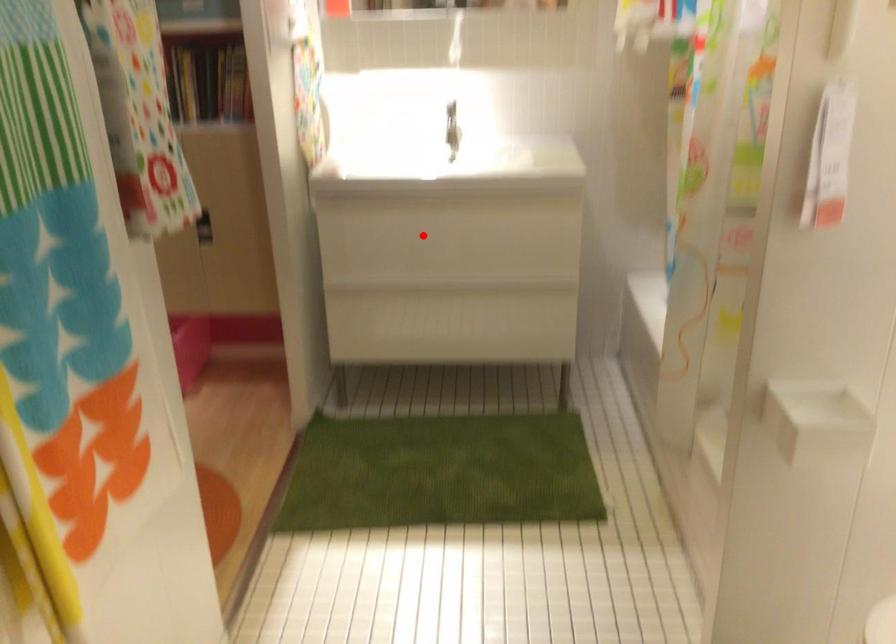
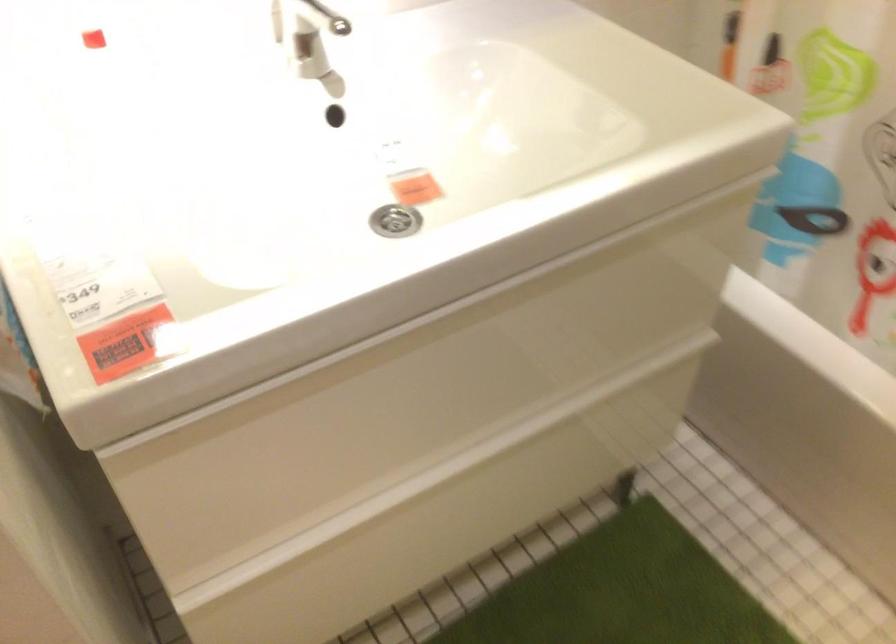
Locate, in the second image, the point that corresponds to the highlighted location in the first image.

(423, 392)